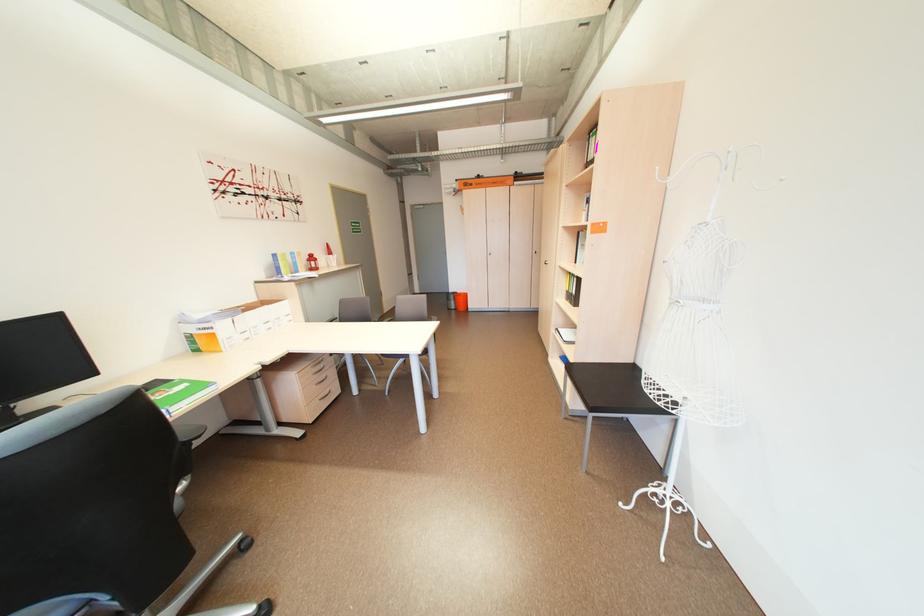
Where would you grasp the black chair armrest? Please return your answer as a coordinate pair (x, y).

(185, 453)